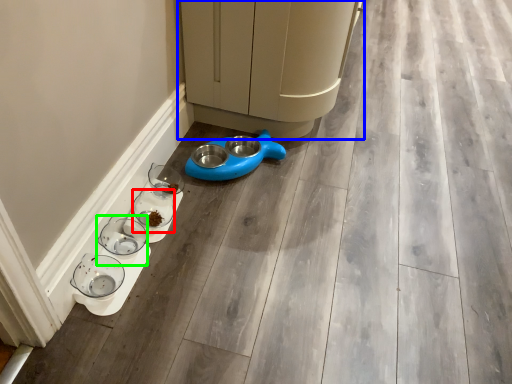
Question: Based on their relative distances, which object is nearer to glass bowl (highlighted by a red box)? Choose from furniture (highlighted by a blue box) and glass bowl (highlighted by a green box).

Choices:
 (A) furniture
 (B) glass bowl

Answer: (B)